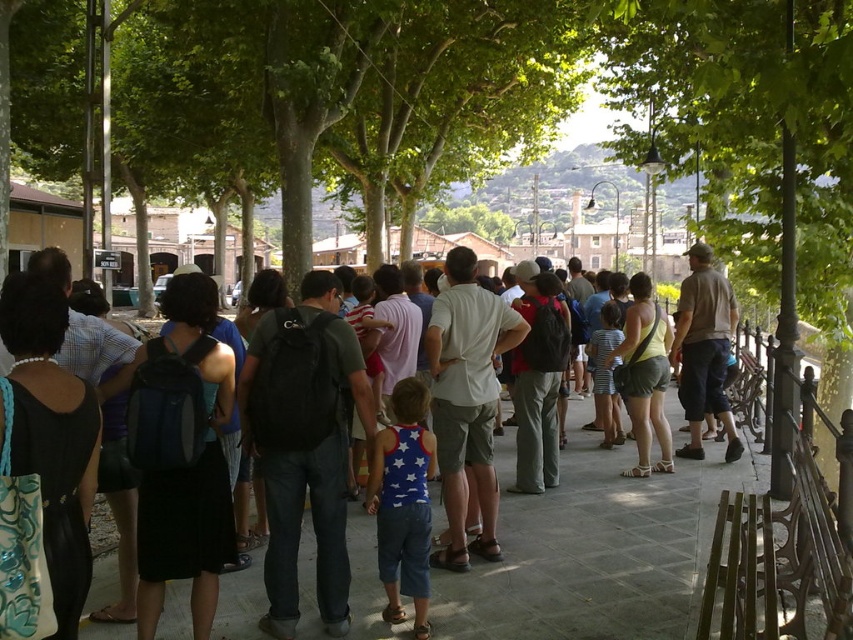
Based on the photo, measure the distance between white cotton shirt at center and camera.

They are 5.41 meters apart.

Identify the location of white cotton shirt at center. (466, 401).

How distant is matte black backpack at center from yellow cotton tank top at center?

matte black backpack at center is 5.35 feet away from yellow cotton tank top at center.

Is point (566, 349) in front of point (631, 401)?

Yes, point (566, 349) is closer to viewer.

Find the location of a particular element. Image resolution: width=853 pixels, height=640 pixels. matte black backpack at center is located at coordinates (537, 381).

I want to click on matte black backpack at center, so click(537, 381).

Does point (103, 582) come in front of point (422, 451)?

No.

Which is behind, point (686, 609) or point (373, 442)?

The point (686, 609) is more distant.

Find the location of a particular element. This screenshot has height=640, width=853. gray concrete pavement at center is located at coordinates (595, 550).